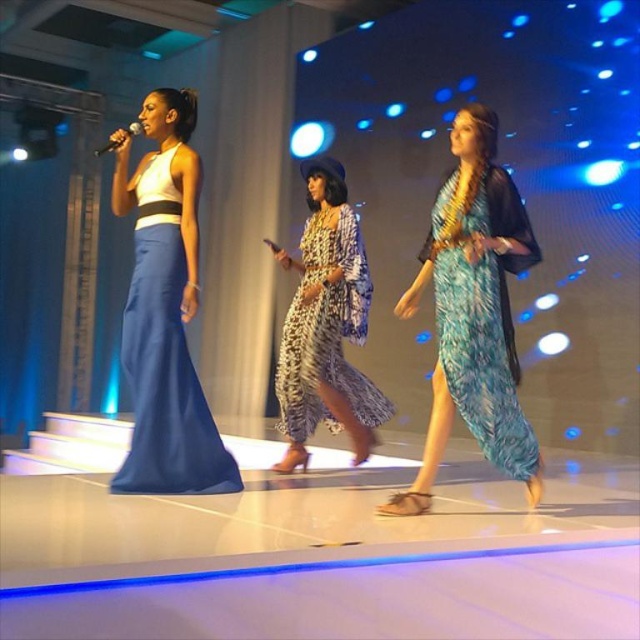
Can you confirm if matte blue dress at left is positioned to the right of printed fabric dress at center?

Incorrect, matte blue dress at left is not on the right side of printed fabric dress at center.

Does point (122, 476) come in front of point (374, 424)?

Yes, it is in front of point (374, 424).

Find the location of a particular element. This screenshot has width=640, height=640. matte blue dress at left is located at coordinates (164, 381).

How much distance is there between blue feathered dress at center and matte blue dress at left?

The distance of blue feathered dress at center from matte blue dress at left is 4.63 feet.

Between blue feathered dress at center and matte blue dress at left, which one appears on the left side from the viewer's perspective?

Positioned to the left is matte blue dress at left.

Is point (481, 436) in front of point (129, 378)?

Yes, point (481, 436) is closer to viewer.

The width and height of the screenshot is (640, 640). What are the coordinates of `blue feathered dress at center` in the screenshot? It's located at (486, 326).

Is blue feathered dress at center wider than printed fabric dress at center?

No.

Is blue feathered dress at center positioned behind printed fabric dress at center?

No, it is not.

Between point (500, 369) and point (317, 394), which one is positioned in front?

Point (500, 369)

The height and width of the screenshot is (640, 640). I want to click on blue feathered dress at center, so click(x=486, y=326).